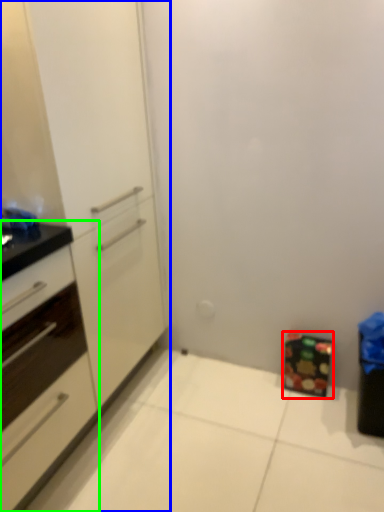
Question: Which object is positioned closest to cabinetry (highlighted by a red box)? Select from cabinetry (highlighted by a blue box) and cabinetry (highlighted by a green box).

Choices:
 (A) cabinetry
 (B) cabinetry

Answer: (A)